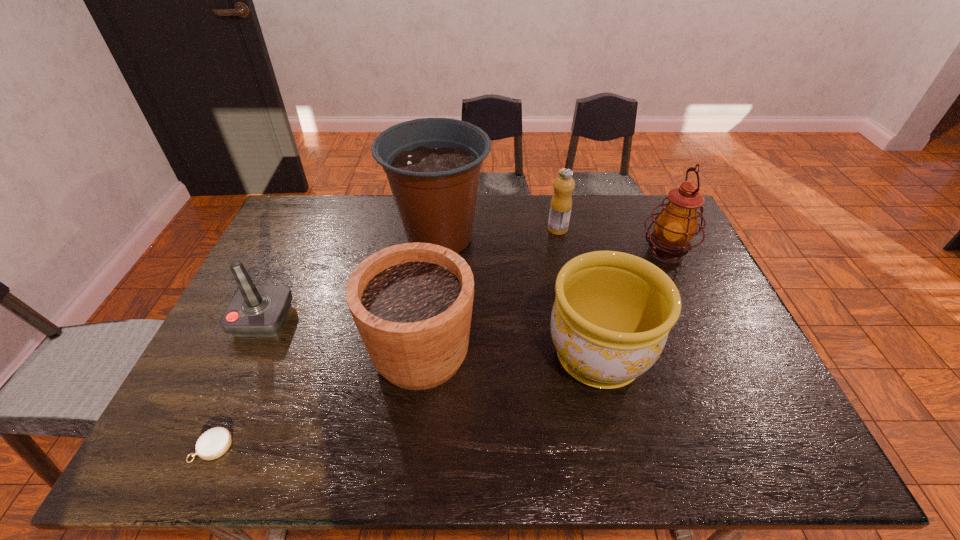
At what (x,y) coordinates should I click in order to perform the action: click on blank space located 0.270m on the front label of the fruit juice. Please return your answer as a coordinate pair (x, y). The image size is (960, 540). Looking at the image, I should click on (469, 229).

Locate an element on the screen. The width and height of the screenshot is (960, 540). blank area located 0.200m on the front label of the fruit juice is located at coordinates (490, 229).

What are the coordinates of `vacant area located 0.200m on the front label of the fruit juice` in the screenshot? It's located at (490, 229).

Locate an element on the screen. This screenshot has height=540, width=960. vacant space located on the back of the joystick is located at coordinates (305, 228).

This screenshot has height=540, width=960. What are the coordinates of `vacant space situated 0.180m on the back of the nearest object` in the screenshot? It's located at (250, 363).

Locate an element on the screen. flowerpot that is at the far edge is located at coordinates (433, 165).

I want to click on oil lamp located at the far edge, so click(x=676, y=225).

You are a GUI agent. You are given a task and a screenshot of the screen. Output one action in this format:
    pyautogui.click(x=<x>, y=<y>)
    Task: Click on the fruit juice that is at the far edge
    This screenshot has width=960, height=540.
    Given the screenshot: What is the action you would take?
    pyautogui.click(x=561, y=203)

This screenshot has width=960, height=540. Find the location of `object that is at the near edge`. object that is at the near edge is located at coordinates (x=212, y=444).

You are a GUI agent. You are given a task and a screenshot of the screen. Output one action in this format:
    pyautogui.click(x=<x>, y=<y>)
    Task: Click on the joystick that is positioned at the left edge
    
    Given the screenshot: What is the action you would take?
    pyautogui.click(x=255, y=310)